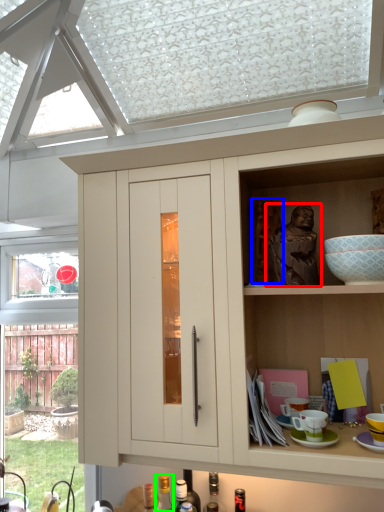
Question: Estimate the real-world distances between objects in this image. Which object is farther from person (highlighted by a red box), sculpture (highlighted by a blue box) or bottle (highlighted by a green box)?

Choices:
 (A) sculpture
 (B) bottle

Answer: (B)